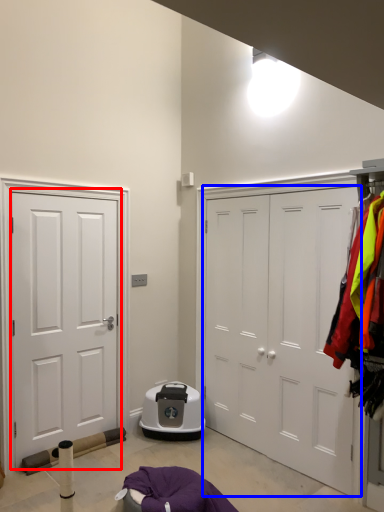
Question: Which point is further to the camera, door (highlighted by a red box) or door (highlighted by a blue box)?

Choices:
 (A) door
 (B) door

Answer: (A)